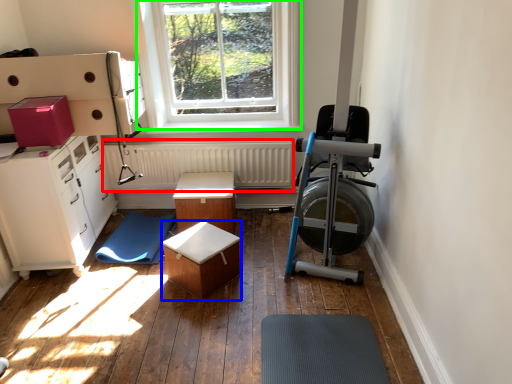
Question: Which is farther away from radiator (highlighted by a red box)? table (highlighted by a blue box) or window (highlighted by a green box)?

Choices:
 (A) table
 (B) window

Answer: (A)